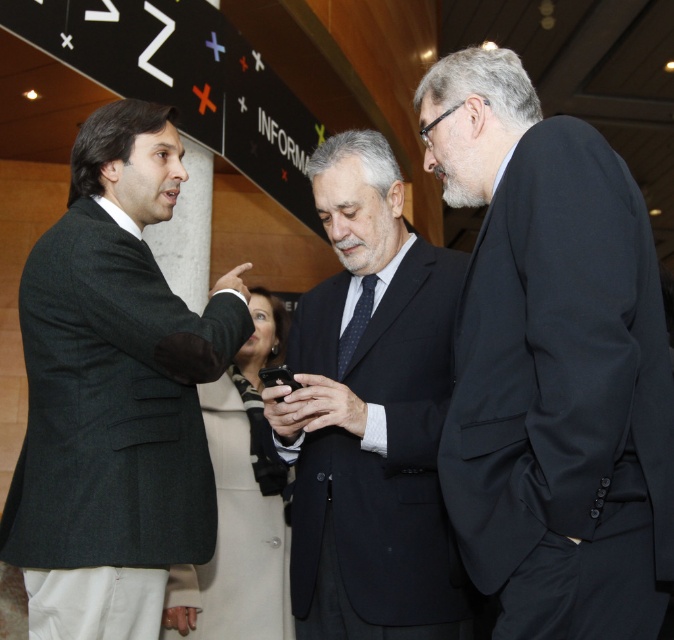
You are organizing a formal event and need to seat these two individuals in chairs that are sized to accommodate their suits. The chairs are labeled as small and large. Based on the image, which chair should each person with the dark blue suit at center and the smooth black suit at center sit in?

The dark blue suit at center is bigger than the smooth black suit at center, so the person wearing the dark blue suit at center should sit in the large chair and the person with the smooth black suit at center should sit in the small chair.

Based on the scene description, where is the black matte suit at right located in the image?

The black matte suit at right is located at point (551, 364) in the image.

You are an event organizer who needs to arrange seating based on the height of the attendees. You see two people wearing the dark blue suit at center and smooth black suit at center. Which one should you seat in the front row to ensure visibility?

The dark blue suit at center is taller than the smooth black suit at center, so seating the smooth black suit at center in the front row would ensure better visibility for both.